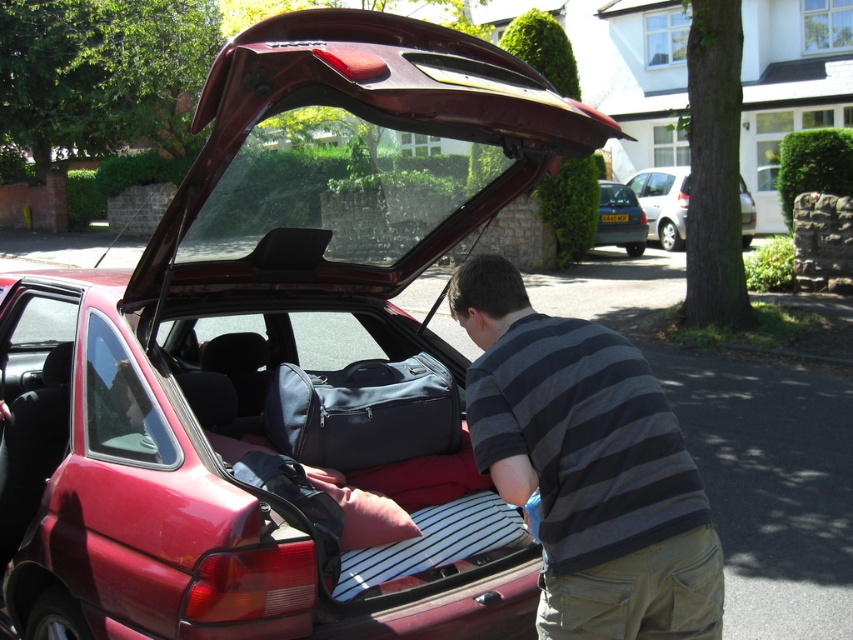
Question: Which of the following is the closest to the observer?

Choices:
 (A) coord(578,436)
 (B) coord(170,436)
 (C) coord(593,240)
 (D) coord(663,244)

Answer: (A)

Question: Does striped cotton shirt at center appear under metallic silver hatchback at center?

Choices:
 (A) yes
 (B) no

Answer: (A)

Question: Does shiny red car at center have a greater width compared to striped cotton shirt at center?

Choices:
 (A) no
 (B) yes

Answer: (A)

Question: Based on their relative distances, which object is nearer to the metallic silver hatchback at center?

Choices:
 (A) striped cotton shirt at center
 (B) shiny red car at center
 (C) silver metallic hatchback at center

Answer: (C)

Question: Based on their relative distances, which object is farther from the metallic silver hatchback at center?

Choices:
 (A) silver metallic hatchback at center
 (B) striped cotton shirt at center
 (C) shiny red car at center

Answer: (B)

Question: Does shiny red car at center appear on the right side of metallic silver hatchback at center?

Choices:
 (A) no
 (B) yes

Answer: (A)